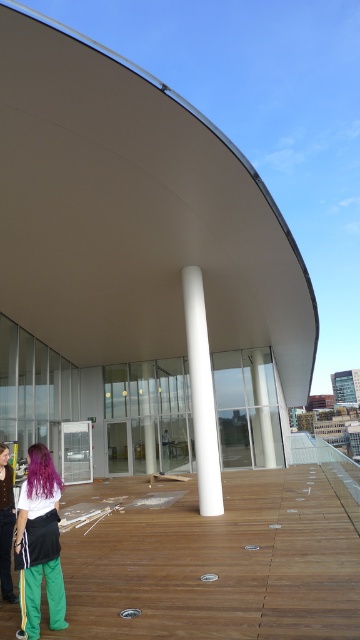
Can you confirm if matte purple hair at lower left is positioned to the right of purple hair at center?

Yes, matte purple hair at lower left is to the right of purple hair at center.

Which is behind, point (56, 589) or point (3, 444)?

Positioned behind is point (3, 444).

Locate an element on the screen. This screenshot has width=360, height=640. matte purple hair at lower left is located at coordinates (38, 545).

Between white glossy column at center and purple silky hair at lower left, which one is positioned lower?

Positioned lower is purple silky hair at lower left.

Who is shorter, white glossy column at center or purple silky hair at lower left?

With less height is purple silky hair at lower left.

Measure the distance between point (200, 380) and camera.

7.94 meters

The height and width of the screenshot is (640, 360). I want to click on white glossy column at center, so click(x=201, y=394).

Is white glossy column at center positioned before purple hair at center?

No, it is behind purple hair at center.

Is point (196, 394) positioned in front of point (0, 444)?

No, (196, 394) is further to viewer.

This screenshot has width=360, height=640. What are the coordinates of `white glossy column at center` in the screenshot? It's located at (201, 394).